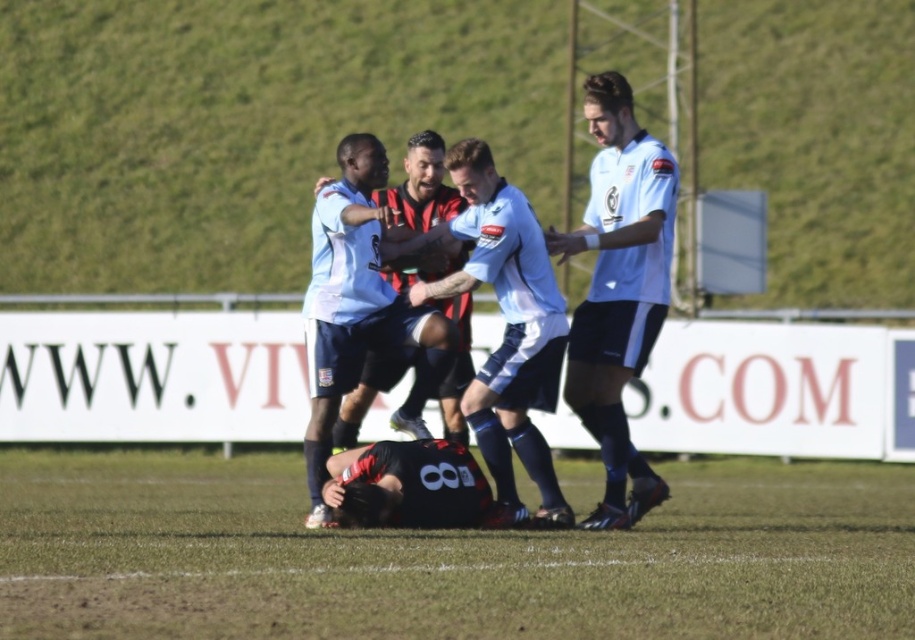
Question: Which point is closer to the camera?

Choices:
 (A) (568, 561)
 (B) (432, 476)
 (C) (582, 392)
 (D) (368, 387)

Answer: (A)

Question: Does green grass football field at lower center have a smaller size compared to matte black jersey at center?

Choices:
 (A) yes
 (B) no

Answer: (B)

Question: Estimate the real-world distances between objects in this image. Which object is farther from the matte black jersey at center?

Choices:
 (A) black jersey at center
 (B) reddish-brown leather jacket at center
 (C) white matte jersey at center
 (D) green grass football field at lower center

Answer: (D)

Question: Is white matte jersey at center in front of reddish-brown leather jacket at center?

Choices:
 (A) no
 (B) yes

Answer: (B)

Question: Which of the following is the closest to the observer?

Choices:
 (A) (480, 236)
 (B) (535, 218)
 (C) (662, 144)

Answer: (A)

Question: Does matte black jersey at center appear under reddish-brown leather jacket at center?

Choices:
 (A) no
 (B) yes

Answer: (A)